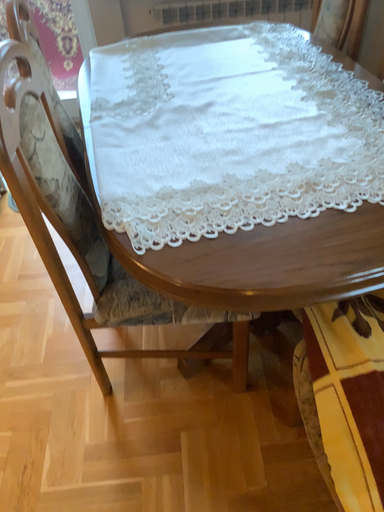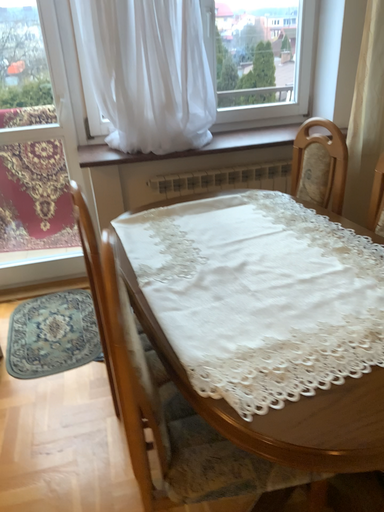
Question: Which way did the camera rotate in the video?

Choices:
 (A) rotated upward
 (B) rotated downward

Answer: (A)